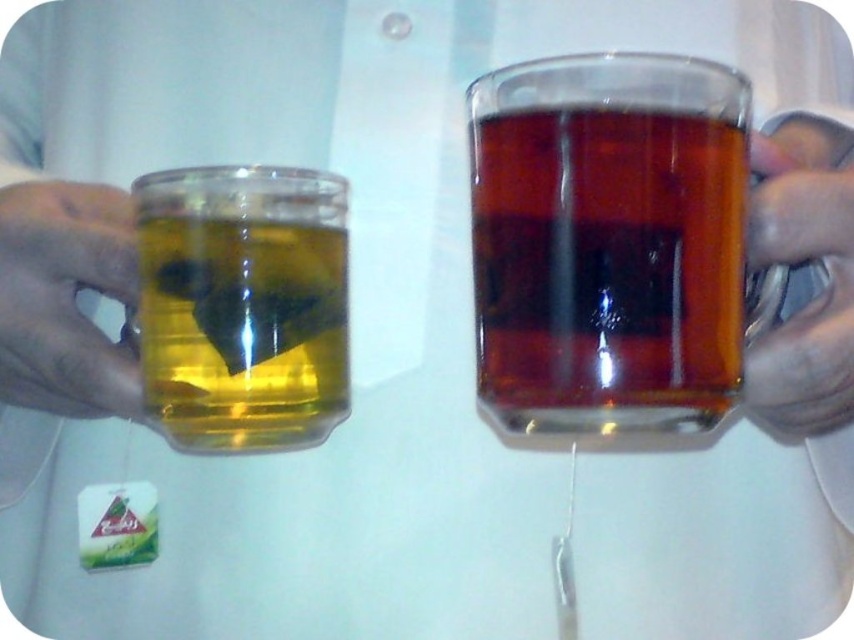
Does matte plastic cup at left have a larger size compared to matte silver pen at right?

Actually, matte plastic cup at left might be smaller than matte silver pen at right.

Is matte plastic cup at left taller than matte silver pen at right?

No, matte plastic cup at left is not taller than matte silver pen at right.

Image resolution: width=854 pixels, height=640 pixels. In order to click on matte plastic cup at left in this screenshot , I will do `click(65, 298)`.

Is translucent glass tea bag at left closer to camera compared to matte silver pen at right?

No.

How much distance is there between translucent glass tea bag at left and matte silver pen at right?

They are 6.16 inches apart.

Where is `translucent glass tea bag at left`? The width and height of the screenshot is (854, 640). translucent glass tea bag at left is located at coordinates (243, 332).

Who is positioned more to the left, translucent glass mug at right or matte plastic cup at left?

matte plastic cup at left is more to the left.

Between translucent glass mug at right and matte plastic cup at left, which one has less height?

matte plastic cup at left

Between point (496, 358) and point (10, 214), which one is positioned behind?

The point (10, 214) is more distant.

Where is `translucent glass mug at right`? translucent glass mug at right is located at coordinates (607, 241).